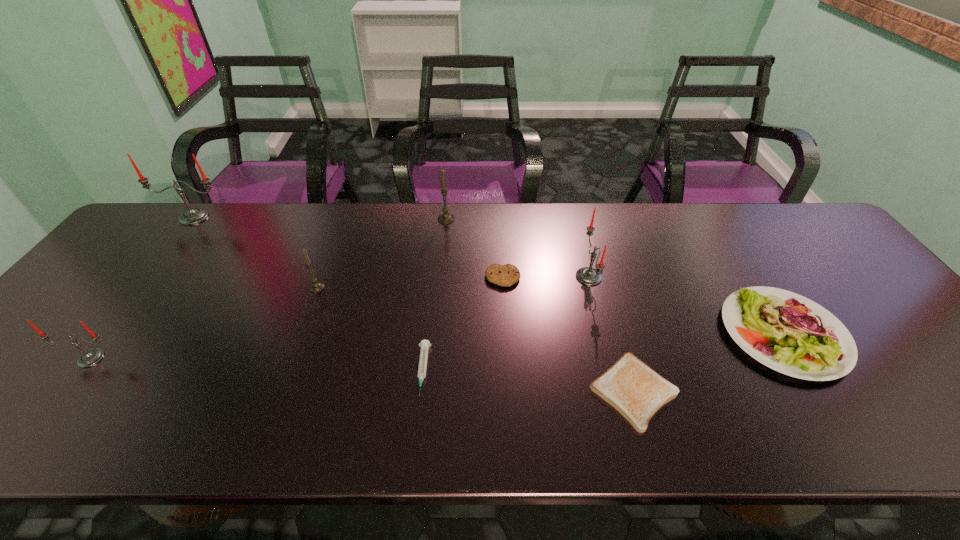
At what (x,y) coordinates should I click in order to perform the action: click on red candle that stands as the third closest to the sixth object from left to right. Please return your answer as a coordinate pair (x, y). This screenshot has height=540, width=960. Looking at the image, I should click on (89, 358).

Where is `free location that satisfies the following two spatial constraints: 1. on the front-facing side of the rightmost object; 2. on the right side of the farthest red candle`? The width and height of the screenshot is (960, 540). free location that satisfies the following two spatial constraints: 1. on the front-facing side of the rightmost object; 2. on the right side of the farthest red candle is located at coordinates (103, 334).

Locate an element on the screen. The image size is (960, 540). vacant point that satisfies the following two spatial constraints: 1. on the front-facing side of the rightmost object; 2. on the right side of the biggest red candle is located at coordinates (103, 334).

Where is `blank space that satisfies the following two spatial constraints: 1. on the front-facing side of the nearest red candle; 2. on the right side of the shortest object`? blank space that satisfies the following two spatial constraints: 1. on the front-facing side of the nearest red candle; 2. on the right side of the shortest object is located at coordinates (66, 391).

Locate an element on the screen. Image resolution: width=960 pixels, height=540 pixels. vacant position in the image that satisfies the following two spatial constraints: 1. on the front-facing side of the second farthest red candle; 2. on the front-facing side of the smallest red candle is located at coordinates (610, 359).

The width and height of the screenshot is (960, 540). I want to click on free point that satisfies the following two spatial constraints: 1. on the front-facing side of the brown cookie; 2. on the left side of the tallest object, so click(147, 278).